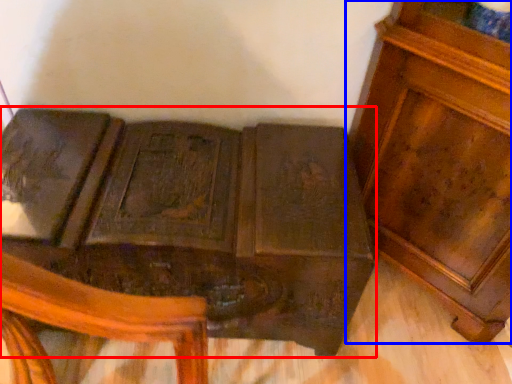
Question: Which of the following is the farthest to the observer, furniture (highlighted by a red box) or furniture (highlighted by a blue box)?

Choices:
 (A) furniture
 (B) furniture

Answer: (A)